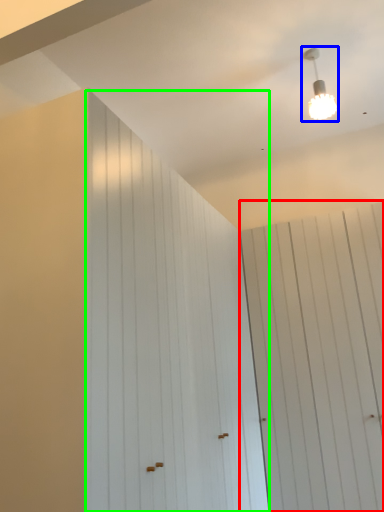
Question: Based on their relative distances, which object is farther from barn door (highlighted by a red box)? Choose from lamp (highlighted by a blue box) and barn door (highlighted by a green box).

Choices:
 (A) lamp
 (B) barn door

Answer: (A)